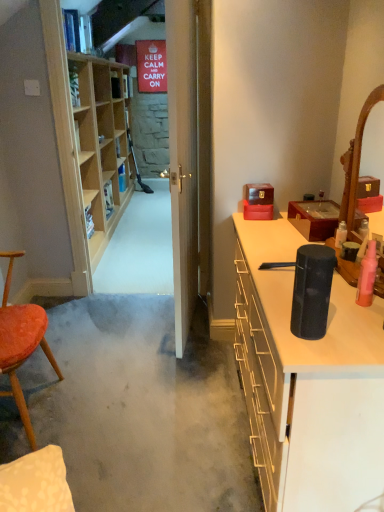
The width and height of the screenshot is (384, 512). What are the coordinates of `vacant space to the right of velvet orange chair at left` in the screenshot? It's located at (103, 413).